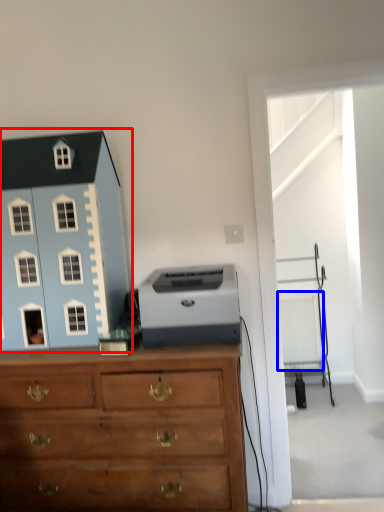
Question: Among these objects, which one is farthest to the camera, toy (highlighted by a red box) or radiator (highlighted by a blue box)?

Choices:
 (A) toy
 (B) radiator

Answer: (B)